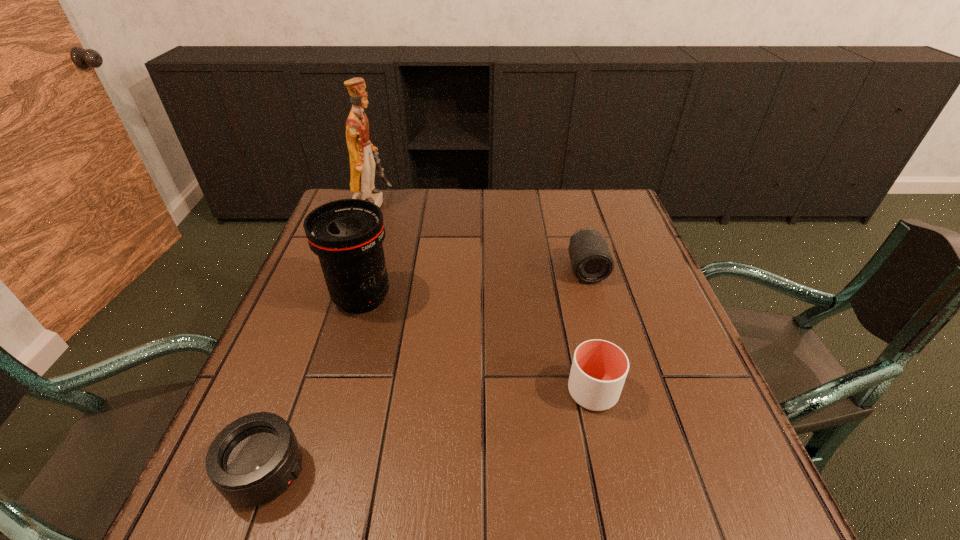
Find the location of a particular element. free point located on the left of the second nearest object is located at coordinates (473, 392).

I want to click on vacant region located 0.130m on the side of the nearest telephoto lens with brand markings and control switches, so click(385, 472).

Locate an element on the screen. The height and width of the screenshot is (540, 960). object that is at the far edge is located at coordinates (363, 155).

Identify the location of object situated at the near edge. (253, 460).

What are the coordinates of `nutcracker that is at the left edge` in the screenshot? It's located at (363, 155).

This screenshot has height=540, width=960. I want to click on object present at the right edge, so click(x=591, y=260).

Identify the location of object at the far left corner. This screenshot has width=960, height=540. (363, 155).

Where is `object that is positioned at the near left corner`? This screenshot has height=540, width=960. object that is positioned at the near left corner is located at coordinates (253, 460).

The image size is (960, 540). In the image, there is a desktop. What are the coordinates of `free space at the far edge` in the screenshot? It's located at (518, 193).

Image resolution: width=960 pixels, height=540 pixels. In order to click on vacant space at the near edge in this screenshot , I will do `click(490, 474)`.